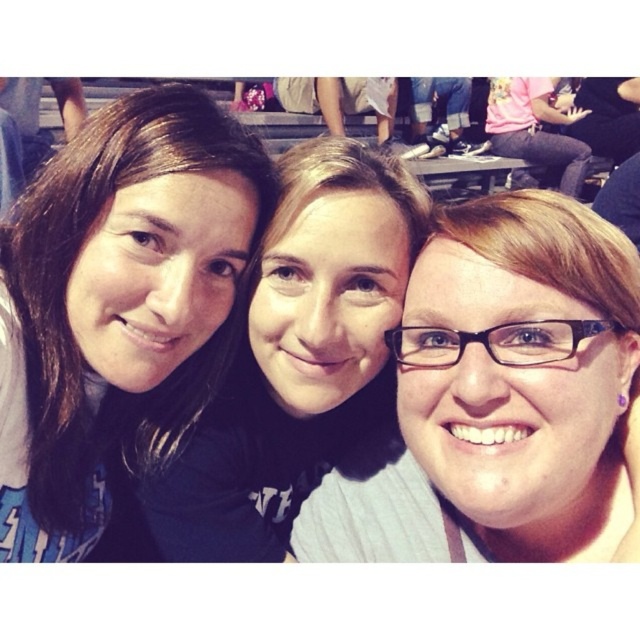
Question: Is matte black glasses at center above matte black shirt at center?

Choices:
 (A) yes
 (B) no

Answer: (B)

Question: Does brown hair at left lie in front of matte black shirt at center?

Choices:
 (A) yes
 (B) no

Answer: (A)

Question: Which point is closer to the camera?

Choices:
 (A) (236, 280)
 (B) (406, 323)

Answer: (B)

Question: Among these points, which one is farthest from the camera?

Choices:
 (A) (152, 476)
 (B) (573, 314)
 (C) (227, 317)

Answer: (A)

Question: Which object is the closest to the matte black glasses at center?

Choices:
 (A) brown hair at left
 (B) matte black shirt at center

Answer: (B)

Question: Can you confirm if brown hair at left is positioned above matte black glasses at center?

Choices:
 (A) yes
 (B) no

Answer: (A)